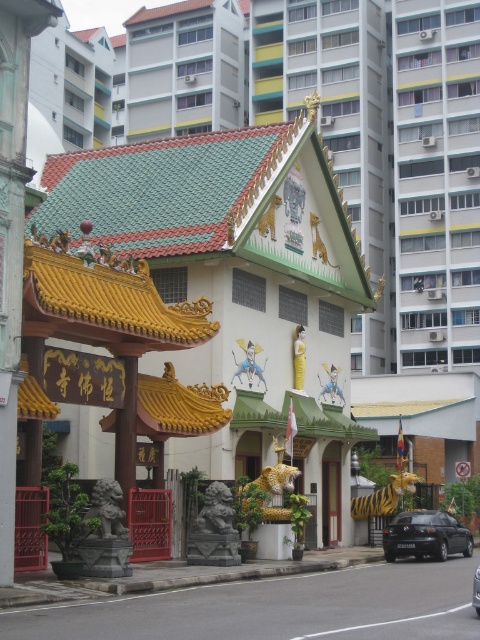
Who is positioned more to the left, black matte car at lower right or black glossy car at center?

From the viewer's perspective, black glossy car at center appears more on the left side.

I want to click on black matte car at lower right, so click(x=425, y=536).

Identify the location of black matte car at lower right. (425, 536).